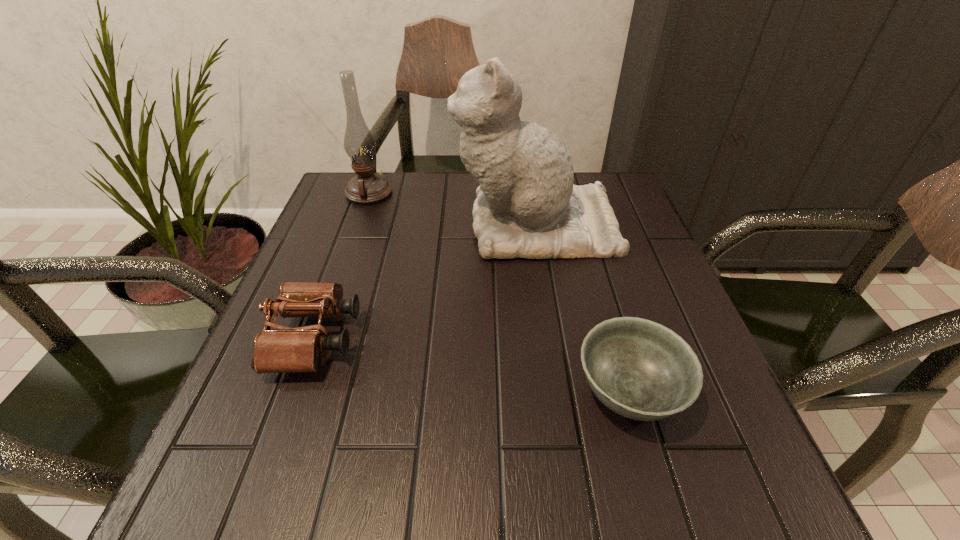
This screenshot has width=960, height=540. Identify the location of cat. (527, 206).

Where is `oil lamp`? This screenshot has width=960, height=540. oil lamp is located at coordinates (367, 187).

This screenshot has height=540, width=960. What are the coordinates of `binoculars` in the screenshot? It's located at (284, 349).

Find the location of a particular element. The image size is (960, 540). bowl is located at coordinates (642, 370).

Locate an element on the screen. The height and width of the screenshot is (540, 960). vacant space located 0.070m on the front-facing side of the tallest object is located at coordinates (424, 225).

This screenshot has height=540, width=960. I want to click on free region located 0.230m on the front-facing side of the tallest object, so click(x=358, y=225).

Find the location of a particular element. The width and height of the screenshot is (960, 540). blank area located 0.310m on the front-facing side of the tallest object is located at coordinates (325, 225).

Where is `vacant space located 0.170m on the front of the second tallest object`? Image resolution: width=960 pixels, height=540 pixels. vacant space located 0.170m on the front of the second tallest object is located at coordinates (349, 248).

Locate an element on the screen. The height and width of the screenshot is (540, 960). free space located through the eyepieces of the binoculars is located at coordinates (564, 339).

I want to click on free space located on the left of the bowl, so click(x=470, y=392).